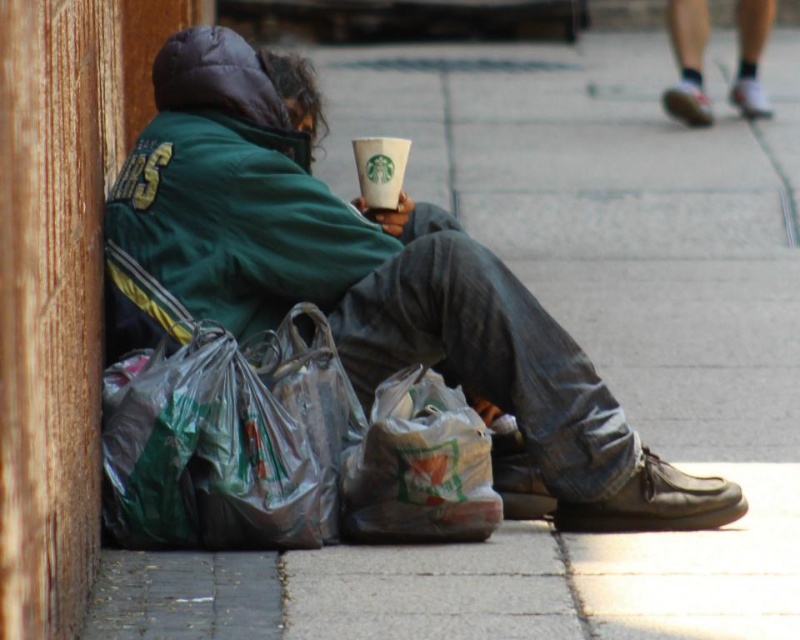
Does green matte jacket at center have a smaller size compared to translucent plastic bag at lower center?

No.

Does point (544, 326) lie behind point (381, 460)?

Yes, it is.

This screenshot has height=640, width=800. Find the location of `green matte jacket at center`. green matte jacket at center is located at coordinates (364, 285).

Does point (352, 252) lie in front of point (364, 164)?

Yes, it is.

Can you confirm if green fabric jacket at center is wider than white paper cup at center?

Correct, the width of green fabric jacket at center exceeds that of white paper cup at center.

The width and height of the screenshot is (800, 640). What are the coordinates of `green fabric jacket at center` in the screenshot? It's located at (226, 202).

Which is behind, point (286, 172) or point (396, 188)?

Positioned behind is point (396, 188).

Between green matte jacket at center and white paper cup at center, which one is positioned higher?

white paper cup at center is higher up.

The height and width of the screenshot is (640, 800). In order to click on green matte jacket at center in this screenshot , I will do `click(364, 285)`.

Where is `green matte jacket at center`? The image size is (800, 640). green matte jacket at center is located at coordinates (364, 285).